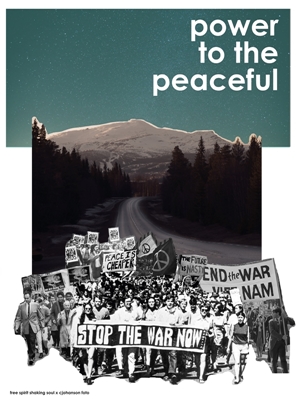
Find the location of a particular element. The width and height of the screenshot is (296, 400). "peace is cheaper" poster is located at coordinates (116, 264).